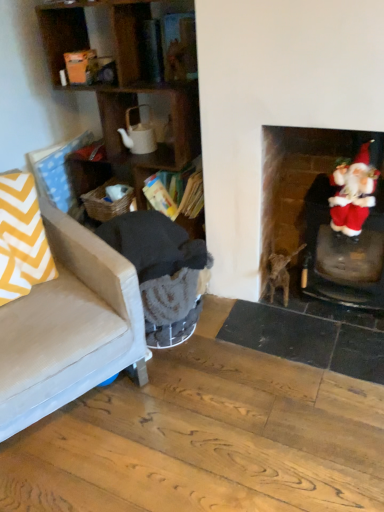
Locate an element on the screen. The image size is (384, 512). wooden bookshelf at center is located at coordinates (175, 194).

Where is `wooden shelves at left`? The image size is (384, 512). wooden shelves at left is located at coordinates point(124,94).

Locate an element on the screen. velvet santa at right is located at coordinates (353, 193).

In order to face yellow chevron fabric at left, should I rotate leftwards or rightwards?

You should look left and rotate roughly 23.440 degrees.

Where is `beige fabric couch at left`? This screenshot has width=384, height=512. beige fabric couch at left is located at coordinates (68, 326).

Image resolution: width=384 pixels, height=512 pixels. What are the coordinates of `dark gray fabric rocking chair at left` in the screenshot? It's located at click(x=161, y=270).

Is woven brown laundry basket at lower left positioned with its back to dark gray fabric rocking chair at left?

That's not correct — woven brown laundry basket at lower left is not looking away from dark gray fabric rocking chair at left.

From a real-world perspective, does woven brown laundry basket at lower left sit lower than dark gray fabric rocking chair at left?

No, from a real-world perspective, woven brown laundry basket at lower left is not below dark gray fabric rocking chair at left.

Considering the sizes of woven brown laundry basket at lower left and dark gray fabric rocking chair at left in the image, is woven brown laundry basket at lower left bigger or smaller than dark gray fabric rocking chair at left?

Clearly, woven brown laundry basket at lower left is smaller in size than dark gray fabric rocking chair at left.

Is point (33, 186) closer or farther from the camera than point (360, 199)?

Point (33, 186) is farther from the camera than point (360, 199).

From a real-world perspective, between yellow chevron fabric at left and velvet santa at right, who is vertically higher?

From a 3D spatial view, velvet santa at right is above.

Is yellow chevron fabric at left oriented towards velvet santa at right?

No, yellow chevron fabric at left does not turn towards velvet santa at right.

In the scene shown: Can you confirm if yellow chevron fabric at left is smaller than velvet santa at right?

Actually, yellow chevron fabric at left might be larger than velvet santa at right.

From the image's perspective, is wooden shelves at left on velvet santa at right?

Yes, from the image's perspective, wooden shelves at left is on top of velvet santa at right.

From a real-world perspective, is wooden shelves at left under velvet santa at right?

No, from a real-world perspective, wooden shelves at left is not below velvet santa at right.

Considering the positions of objects wooden shelves at left and velvet santa at right in the image provided, who is more to the right, wooden shelves at left or velvet santa at right?

Positioned to the right is velvet santa at right.

From their relative heights in the image, would you say wooden shelves at left is taller or shorter than velvet santa at right?

Considering their sizes, wooden shelves at left has more height than velvet santa at right.

Which object is further away from the camera taking this photo, woven brown laundry basket at lower left or wooden bookshelf at center?

woven brown laundry basket at lower left is behind.

Does woven brown laundry basket at lower left contain wooden bookshelf at center?

No, woven brown laundry basket at lower left does not contain wooden bookshelf at center.

Identify the location of laundry basket located above the wooden bookshelf at center (from the image's perspective). (106, 202).

Considering the relative positions of woven brown laundry basket at lower left and wooden bookshelf at center in the image provided, is woven brown laundry basket at lower left to the left of wooden bookshelf at center from the viewer's perspective?

Yes.

Considering the sizes of brown fur cat at center and velvet santa at right in the image, is brown fur cat at center taller or shorter than velvet santa at right?

Considering their sizes, brown fur cat at center has less height than velvet santa at right.

Where is `animal that is below the velvet santa at right (from the image's perspective)`? animal that is below the velvet santa at right (from the image's perspective) is located at coordinates (280, 273).

Considering the sizes of objects brown fur cat at center and velvet santa at right in the image provided, who is bigger, brown fur cat at center or velvet santa at right?

velvet santa at right is bigger.

From a real-world perspective, is brown fur cat at center positioned over velvet santa at right based on gravity?

Actually, brown fur cat at center is physically below velvet santa at right in the real world.

Which point is more distant from viewer, (105, 186) or (347, 297)?

Point (105, 186)

Is woven brown laundry basket at lower left far away from velvet santa at right?

No.

How different are the orientations of woven brown laundry basket at lower left and velvet santa at right in degrees?

10.1 degrees separate the facing orientations of woven brown laundry basket at lower left and velvet santa at right.

Considering the sizes of objects woven brown laundry basket at lower left and velvet santa at right in the image provided, who is thinner, woven brown laundry basket at lower left or velvet santa at right?

woven brown laundry basket at lower left is thinner.

In the scene shown: Considering the relative positions of yellow chevron fabric at left and beige fabric couch at left in the image provided, is yellow chevron fabric at left to the left or to the right of beige fabric couch at left?

From the image, it's evident that yellow chevron fabric at left is to the left of beige fabric couch at left.

From the picture: Does yellow chevron fabric at left have a lesser width compared to beige fabric couch at left?

Yes.

Is there a large distance between yellow chevron fabric at left and beige fabric couch at left?

No, there isn't a large distance between yellow chevron fabric at left and beige fabric couch at left.

Identify the location of rocking chair that is under the woven brown laundry basket at lower left (from a real-world perspective). (161, 270).

The width and height of the screenshot is (384, 512). I want to click on throw pillow below the velvet santa at right (from the image's perspective), so click(x=22, y=238).

Looking at the image, which one is located further to brown fur cat at center, velvet santa at right or wooden shelves at left?

wooden shelves at left is further to brown fur cat at center.

Which object lies further to the anchor point wooden shelves at left, beige fabric couch at left or velvet santa at right?

velvet santa at right is further to wooden shelves at left.

Considering their positions, is woven brown laundry basket at lower left positioned further to dark gray fabric rocking chair at left than wooden bookshelf at center?

woven brown laundry basket at lower left is positioned further to the anchor dark gray fabric rocking chair at left.

When comparing their distances from wooden shelves at left, does beige fabric couch at left or brown fur cat at center seem closer?

beige fabric couch at left is closer to wooden shelves at left.

Which object lies nearer to the anchor point wooden bookshelf at center, dark gray fabric rocking chair at left or woven brown laundry basket at lower left?

The object closer to wooden bookshelf at center is woven brown laundry basket at lower left.

Which object lies further to the anchor point brown fur cat at center, wooden shelves at left or wooden bookshelf at center?

The object further to brown fur cat at center is wooden shelves at left.

Estimate the real-world distances between objects in this image. Which object is further from brown fur cat at center, wooden bookshelf at center or velvet santa at right?

Based on the image, wooden bookshelf at center appears to be further to brown fur cat at center.

Estimate the real-world distances between objects in this image. Which object is further from woven brown laundry basket at lower left, dark gray fabric rocking chair at left or beige fabric couch at left?

The object further to woven brown laundry basket at lower left is beige fabric couch at left.

Identify the location of cabinetry between yellow chevron fabric at left and wooden bookshelf at center from left to right. This screenshot has width=384, height=512. (124, 94).

Find the location of `rocking chair situated between yellow chevron fabric at left and brown fur cat at center from left to right`. rocking chair situated between yellow chevron fabric at left and brown fur cat at center from left to right is located at coordinates (161, 270).

I want to click on shelf located between dark gray fabric rocking chair at left and brown fur cat at center in the left-right direction, so click(175, 194).

The height and width of the screenshot is (512, 384). I want to click on shelf between yellow chevron fabric at left and velvet santa at right from left to right, so click(175, 194).